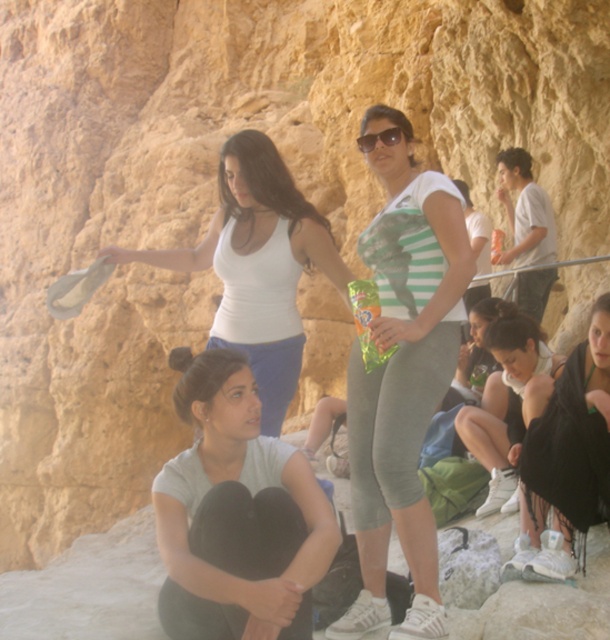
You are a photographer trying to capture a closeup of the white matte tank top at upper center and the matte black sunglasses at center. Since your camera can only focus on one object at a time, which object should you adjust the focus to first to ensure it fills the frame more?

The white matte tank top at upper center should be focused on first because it is wider than the matte black sunglasses at center, allowing it to fill the frame more effectively.

You are standing at point (400, 132) and want to walk to point (295, 321). Which direction should you move relative to your current position?

Result: You should move forward because point (295, 321) is behind point (400, 132), meaning it is in the direction you are facing if you are at point (400, 132).